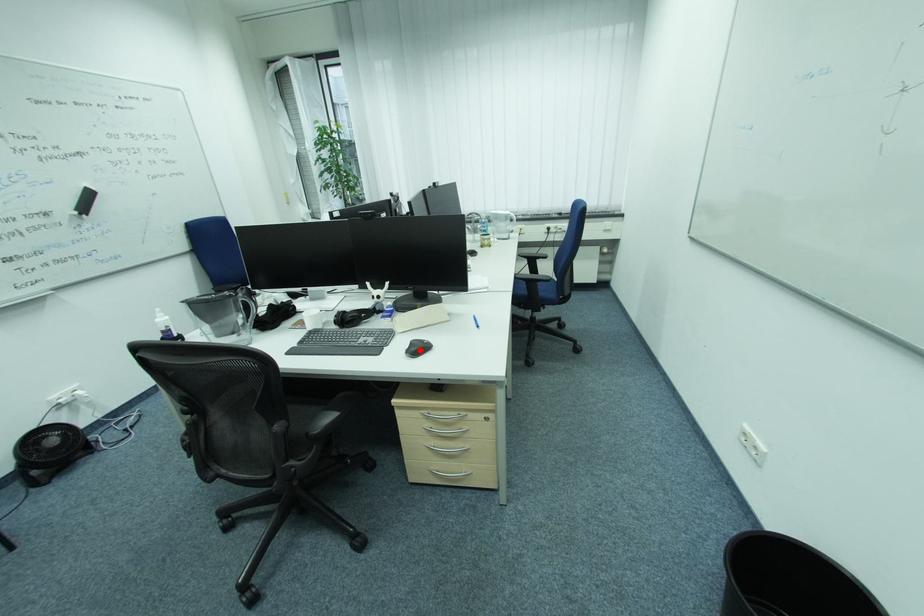
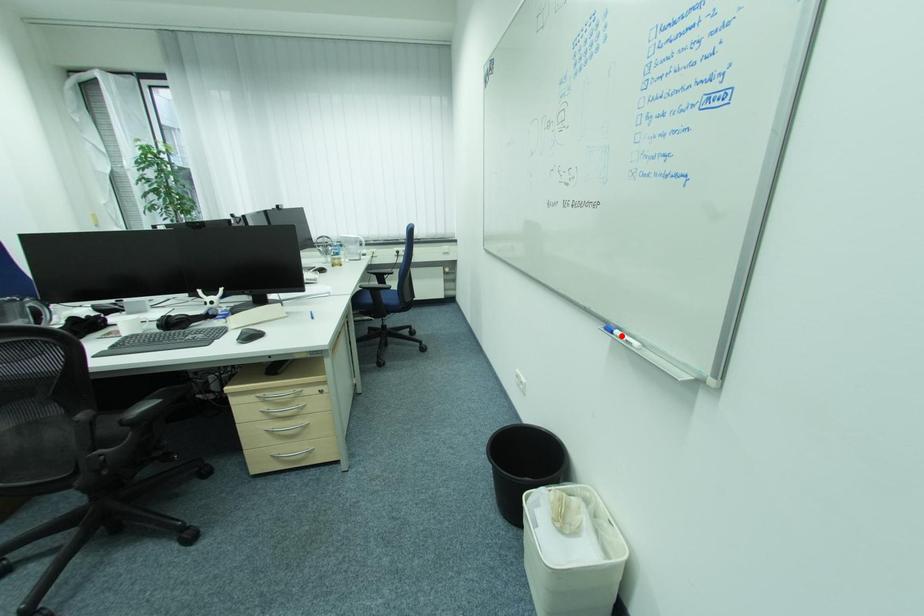
I am providing you with two images of the same scene from different viewpoints. A red point is marked on the first image and another point is marked on the second image. Does the point marked in image1 correspond to the same location as the one in image2?

No